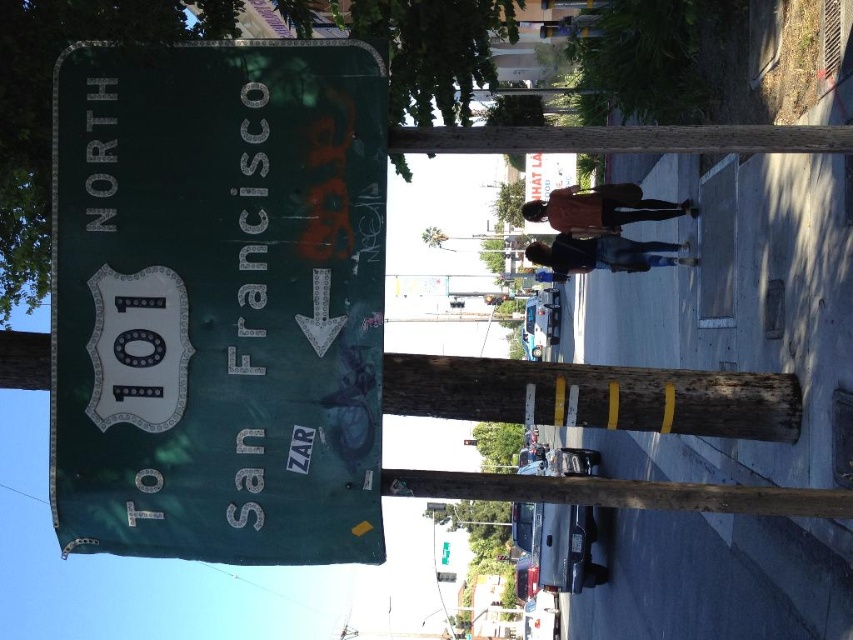
Is wooden post at center smaller than brown wooden pole at center?

No.

Between wooden post at center and brown wooden pole at center, which one appears on the right side from the viewer's perspective?

wooden post at center is more to the right.

You are a GUI agent. You are given a task and a screenshot of the screen. Output one action in this format:
    pyautogui.click(x=<x>, y=<y>)
    Task: Click on the wooden post at center
    Image resolution: width=853 pixels, height=640 pixels.
    Given the screenshot: What is the action you would take?
    pyautogui.click(x=595, y=396)

Is green matte sign at left above wooden post at center?

Yes, green matte sign at left is above wooden post at center.

Who is more distant from viewer, [120,400] or [9,371]?

Positioned behind is point [9,371].

Who is more distant from viewer, (358, 328) or (792, 392)?

Positioned behind is point (792, 392).

Locate an element on the screen. The image size is (853, 640). green matte sign at left is located at coordinates (218, 300).

Which is in front, point (291, 204) or point (688, 132)?

Point (291, 204)

Who is lower down, green matte sign at left or brown wooden pole at center?

green matte sign at left is below.

Does point (144, 330) lie behind point (602, 148)?

No, it is in front of (602, 148).

Locate an element on the screen. The image size is (853, 640). green matte sign at left is located at coordinates (218, 300).